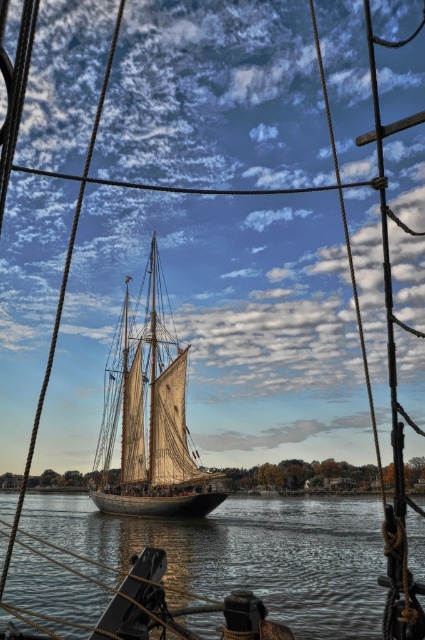
Which is more to the left, clear water at center or wooden sailboat at center?

Positioned to the left is wooden sailboat at center.

Is clear water at center further to the viewer compared to wooden sailboat at center?

No.

Which is in front, point (261, 577) or point (152, 396)?

Point (261, 577) is more forward.

You are a GUI agent. You are given a task and a screenshot of the screen. Output one action in this format:
    pyautogui.click(x=<x>, y=<y>)
    Task: Click on the clear water at center
    The width and height of the screenshot is (425, 640).
    Given the screenshot: What is the action you would take?
    pyautogui.click(x=246, y=554)